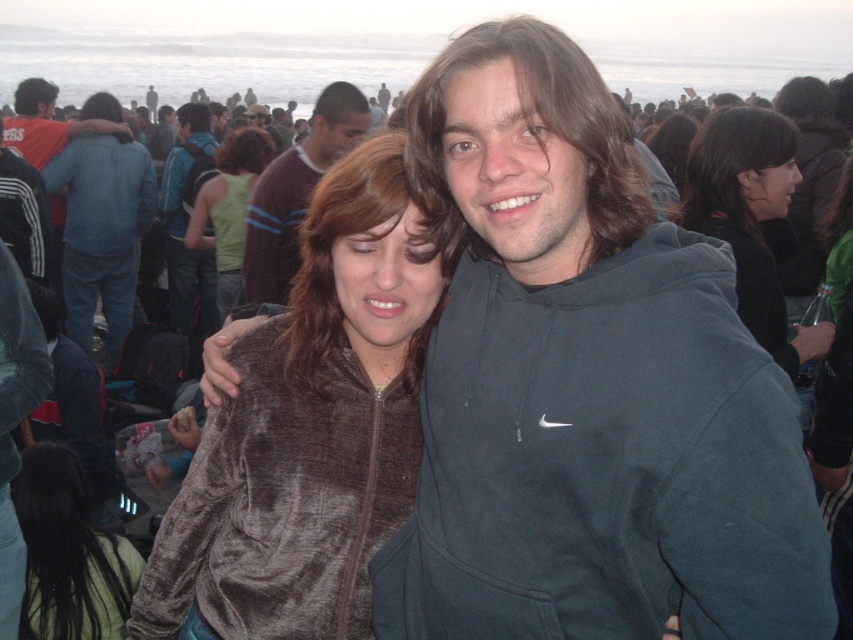
You are an event organizer trying to arrange seating for two guests who will be sitting side by side. You have two velvet brown jackets and hoodies available. Given the velvet brown jacket at center and the velvet brown hoodie at center, which one is wider and should be placed on the side to accommodate more space?

The velvet brown jacket at center is wider than the velvet brown hoodie at center, so it should be placed on the side to provide more space.